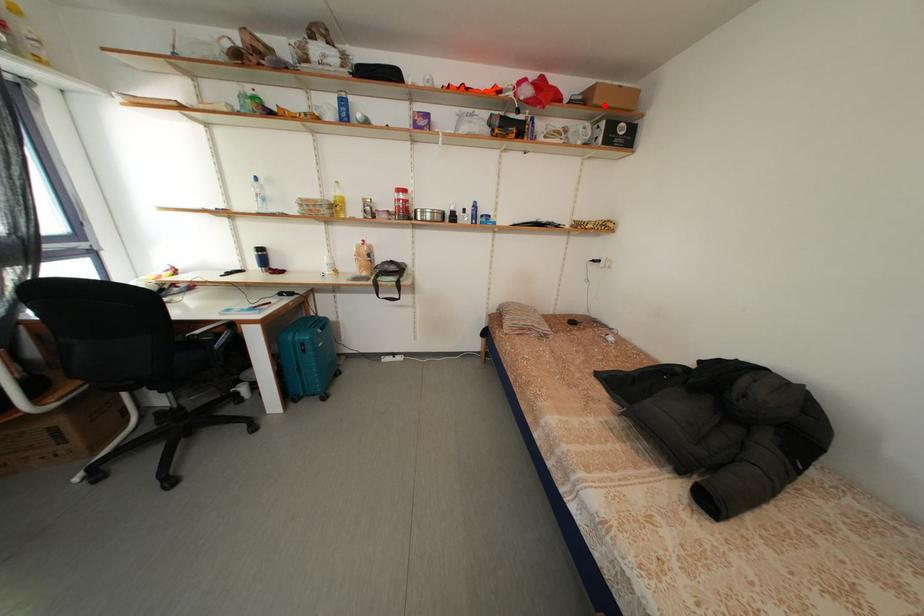
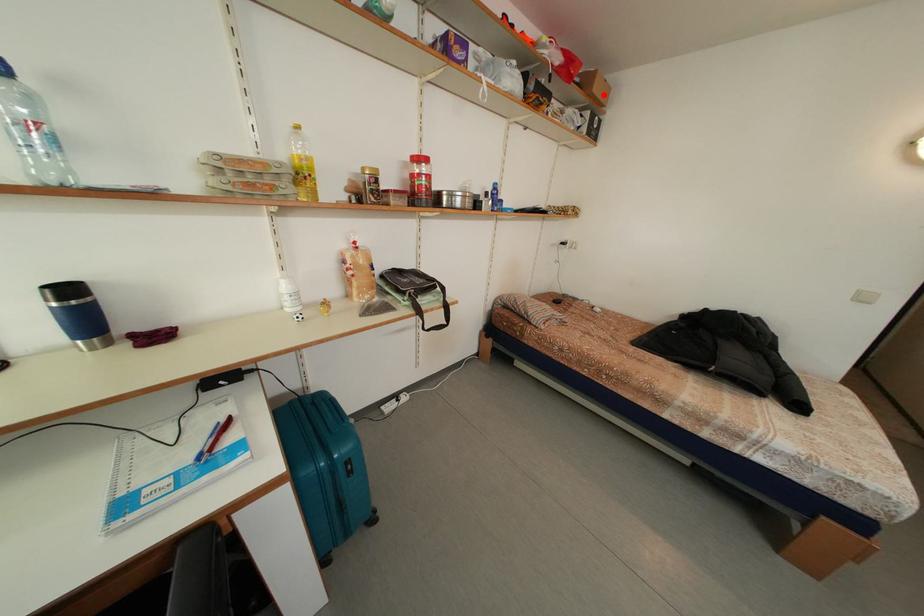
I am providing you with two images of the same scene from different viewpoints. A red point is marked on the first image and another point is marked on the second image. Is the marked point in image1 the same physical position as the marked point in image2?

Yes